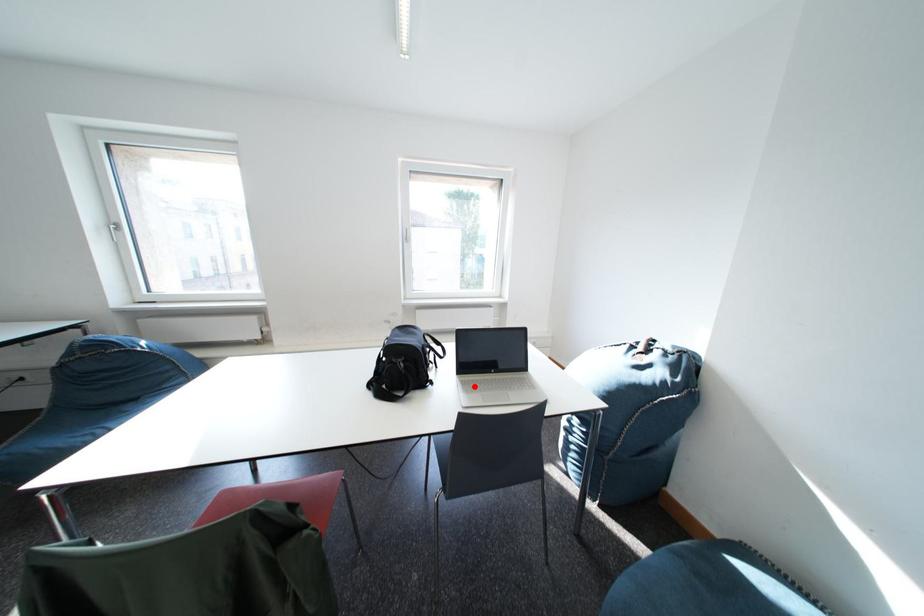
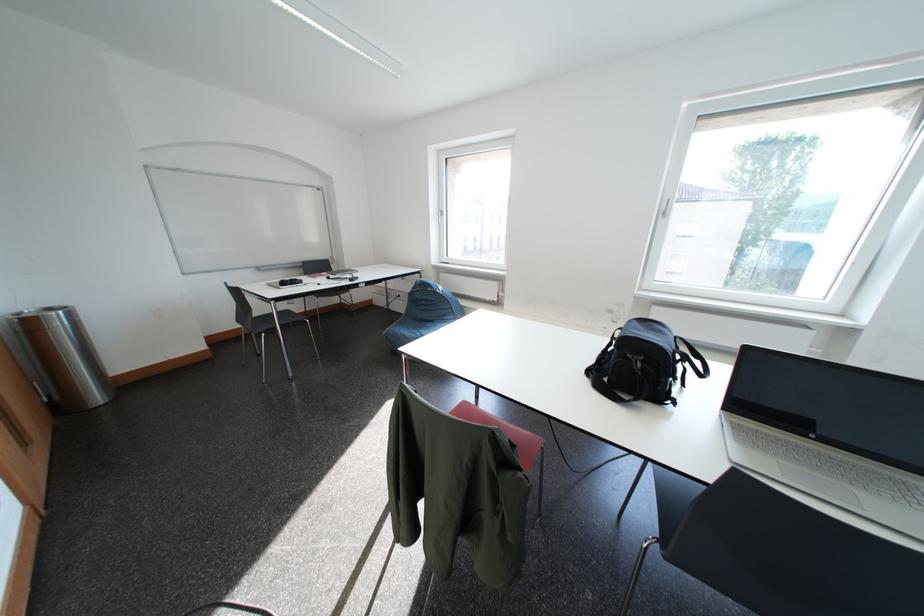
In the second image, find the point that corresponds to the highlighted location in the first image.

(747, 431)